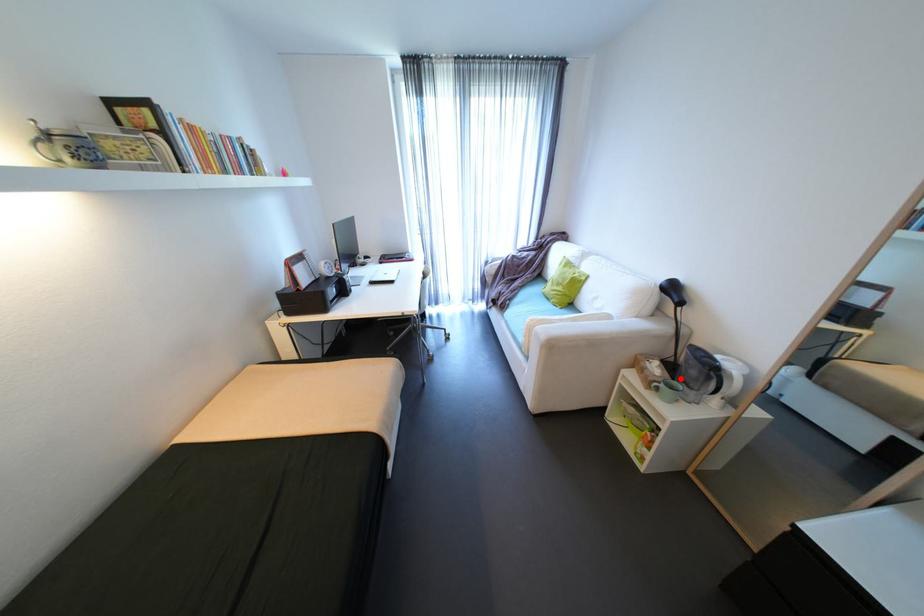
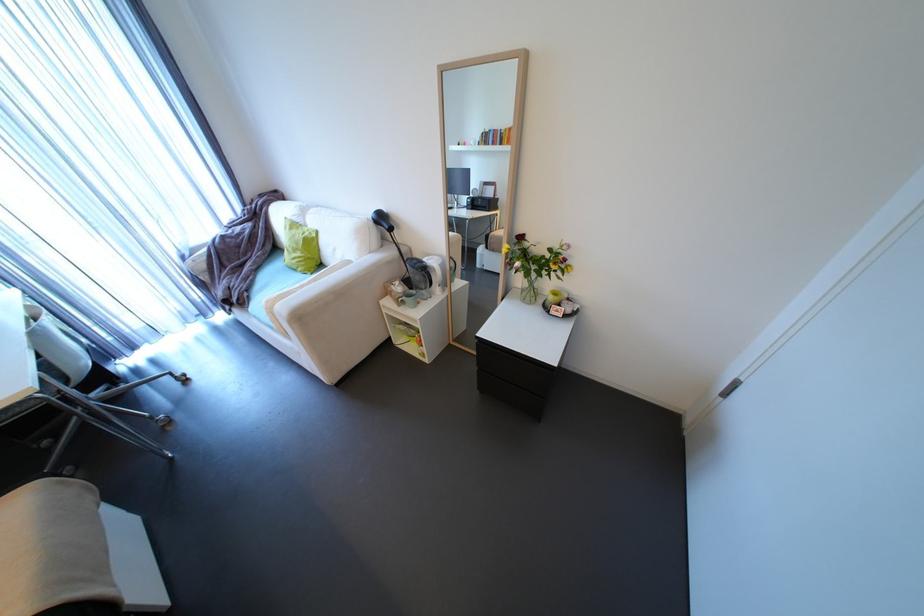
Where in the second image is the point corresponding to the highlighted location from the first image?

(419, 289)